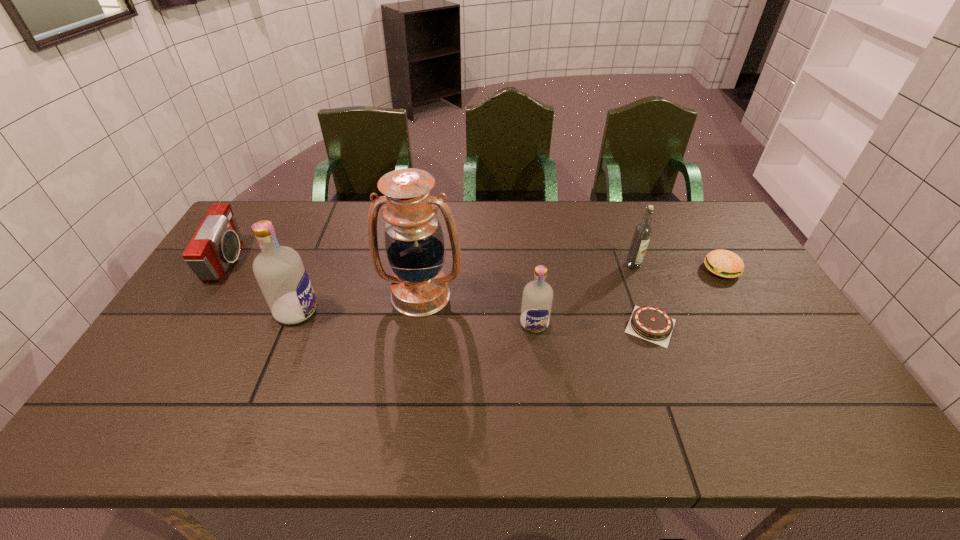
I want to click on vacant space that satisfies the following two spatial constraints: 1. on the label of the rightmost object; 2. on the left side of the rightmost vodka, so click(x=635, y=269).

Image resolution: width=960 pixels, height=540 pixels. I want to click on vacant point that satisfies the following two spatial constraints: 1. on the front-facing side of the third shortest object; 2. on the back side of the sixth tallest object, so click(x=223, y=269).

At what (x,y) coordinates should I click in order to perform the action: click on vacant region that satisfies the following two spatial constraints: 1. on the front-facing side of the leftmost object; 2. on the left side of the patty. Please return your answer as a coordinate pair (x, y). This screenshot has width=960, height=540. Looking at the image, I should click on (223, 269).

The width and height of the screenshot is (960, 540). I want to click on free point that satisfies the following two spatial constraints: 1. on the front side of the rightmost object; 2. on the label of the tallest vodka, so click(746, 311).

You are a GUI agent. You are given a task and a screenshot of the screen. Output one action in this format:
    pyautogui.click(x=<x>, y=<y>)
    Task: Click on the free space that satisfies the following two spatial constraints: 1. on the label of the shortest object; 2. on the left side of the second vodka from right to left
    
    Given the screenshot: What is the action you would take?
    pyautogui.click(x=535, y=326)

At what (x,y) coordinates should I click in order to perform the action: click on free region that satisfies the following two spatial constraints: 1. on the label of the shortest object; 2. on the left side of the second vodka from right to left. Please return your answer as a coordinate pair (x, y). The image size is (960, 540). Looking at the image, I should click on (535, 326).

The width and height of the screenshot is (960, 540). I want to click on vacant area in the image that satisfies the following two spatial constraints: 1. on the label of the farthest vodka; 2. on the label of the tallest vodka, so pyautogui.click(x=650, y=311).